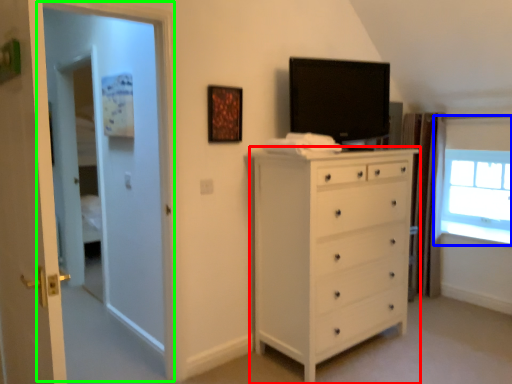
Question: Which is nearer to the chest of drawers (highlighted by a red box)? window (highlighted by a blue box) or screen door (highlighted by a green box).

Choices:
 (A) window
 (B) screen door

Answer: (B)